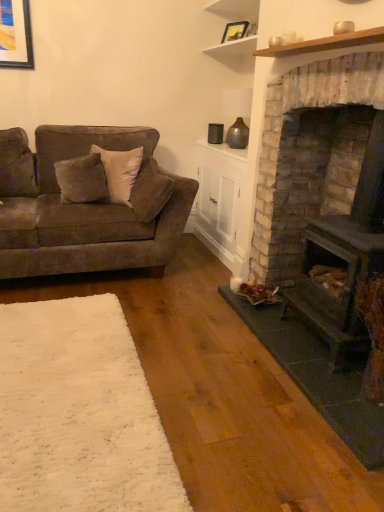
Question: Would you say velvet gray pillow at left is to the left or to the right of white soft rug at lower left in the picture?

Choices:
 (A) left
 (B) right

Answer: (A)

Question: In the image, is velvet gray pillow at left positioned in front of or behind white soft rug at lower left?

Choices:
 (A) front
 (B) behind

Answer: (B)

Question: Which object is the closest to the brick textured wood burning stove at right?

Choices:
 (A) matte black picture frame at upper center
 (B) velvet brown couch at left
 (C) velvet gray pillow at left
 (D) white soft rug at lower left
 (E) white wood shelf at upper center

Answer: (D)

Question: Estimate the real-world distances between objects in this image. Which object is closer to the velvet gray pillow at left?

Choices:
 (A) velvet brown couch at left
 (B) brick textured wood burning stove at right
 (C) matte black picture frame at upper center
 (D) white soft rug at lower left
 (E) white wood shelf at upper center

Answer: (A)